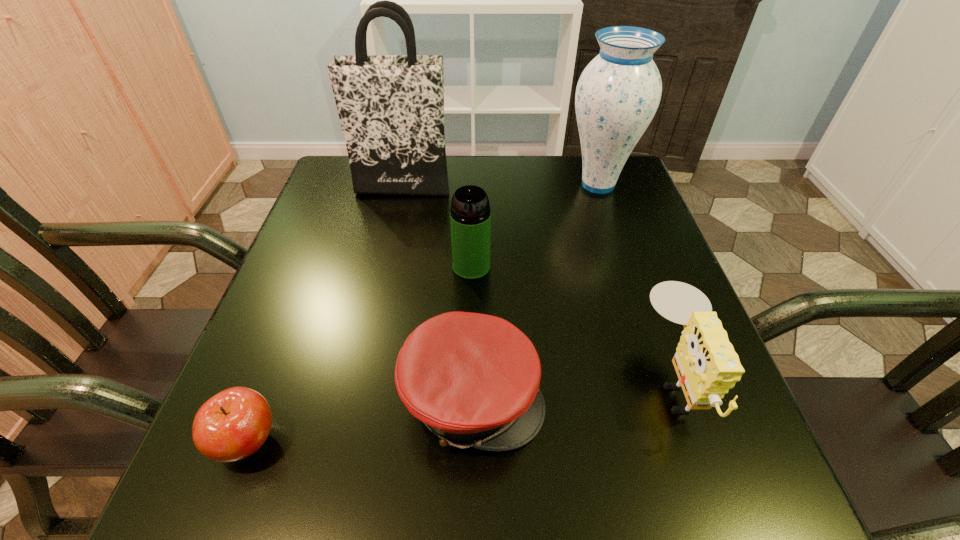
This screenshot has height=540, width=960. In order to click on apple at the left edge in this screenshot , I will do `click(232, 425)`.

Where is `vase that is at the right edge`? vase that is at the right edge is located at coordinates (617, 95).

This screenshot has width=960, height=540. In order to click on sponge located at the right edge in this screenshot , I will do `click(707, 366)`.

Locate an element on the screen. This screenshot has height=540, width=960. object positioned at the far left corner is located at coordinates [x=391, y=107].

This screenshot has height=540, width=960. What are the coordinates of `object located in the near left corner section of the desktop` in the screenshot? It's located at (232, 425).

Locate an element on the screen. The image size is (960, 540). object located in the far right corner section of the desktop is located at coordinates (617, 95).

You are a GUI agent. You are given a task and a screenshot of the screen. Output one action in this format:
    pyautogui.click(x=<x>, y=<y>)
    Task: Click on the vacant space at the far edge
    
    Given the screenshot: What is the action you would take?
    pyautogui.click(x=531, y=162)

This screenshot has height=540, width=960. Find the location of `vacant space at the left edge`. vacant space at the left edge is located at coordinates (307, 233).

The width and height of the screenshot is (960, 540). Identify the location of free location at the right edge of the desktop. (x=590, y=221).

This screenshot has width=960, height=540. What are the coordinates of `blank space at the far left corner of the desktop` in the screenshot? It's located at (352, 199).